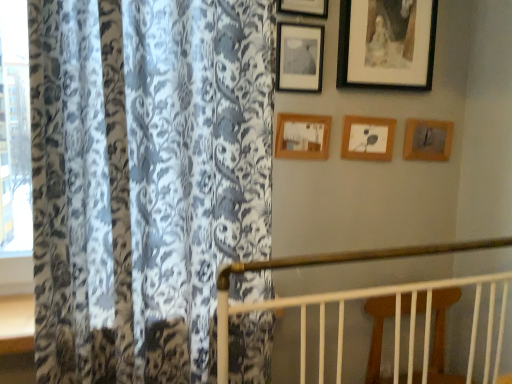
Question: Can you confirm if wooden picture frame at upper center, the 4th picture frame when ordered from left to right, is taller than wooden picture frame at upper center, which is the second picture frame from left to right?

Choices:
 (A) yes
 (B) no

Answer: (B)

Question: Does wooden picture frame at upper center, the 4th picture frame when ordered from left to right, come behind wooden picture frame at upper center, the fifth picture frame when ordered from right to left?

Choices:
 (A) yes
 (B) no

Answer: (A)

Question: From a real-world perspective, is wooden picture frame at upper center, the 4th picture frame when ordered from left to right, positioned under wooden picture frame at upper center, which is the second picture frame from left to right, based on gravity?

Choices:
 (A) yes
 (B) no

Answer: (A)

Question: Does wooden picture frame at upper center, the 4th picture frame when ordered from left to right, have a larger size compared to wooden picture frame at upper center, which is the second picture frame from left to right?

Choices:
 (A) yes
 (B) no

Answer: (B)

Question: Is wooden picture frame at upper center, the 4th picture frame when ordered from left to right, facing towards wooden picture frame at upper center, which is the second picture frame from left to right?

Choices:
 (A) yes
 (B) no

Answer: (B)

Question: Is wooden picture frame at upper center, positioned as the 3th picture frame in right-to-left order, looking in the opposite direction of wooden picture frame at upper center, which is the second picture frame from left to right?

Choices:
 (A) yes
 (B) no

Answer: (B)

Question: Considering the relative sizes of wooden picture frame at upper center, the fifth picture frame when ordered from right to left, and floral-patterned fabric at left in the image provided, is wooden picture frame at upper center, the fifth picture frame when ordered from right to left, bigger than floral-patterned fabric at left?

Choices:
 (A) yes
 (B) no

Answer: (B)

Question: Is wooden picture frame at upper center, the fifth picture frame when ordered from right to left, facing towards floral-patterned fabric at left?

Choices:
 (A) no
 (B) yes

Answer: (A)

Question: Is wooden picture frame at upper center, which is the second picture frame from left to right, behind floral-patterned fabric at left?

Choices:
 (A) no
 (B) yes

Answer: (B)

Question: Is wooden picture frame at upper center, which is the second picture frame from left to right, not close to floral-patterned fabric at left?

Choices:
 (A) no
 (B) yes

Answer: (A)

Question: From a real-world perspective, is wooden picture frame at upper center, which is the second picture frame from left to right, below floral-patterned fabric at left?

Choices:
 (A) no
 (B) yes

Answer: (A)

Question: Are wooden picture frame at upper center, the fifth picture frame when ordered from right to left, and floral-patterned fabric at left beside each other?

Choices:
 (A) no
 (B) yes

Answer: (A)

Question: Is wooden picture frame at upper center, the fifth picture frame when ordered from right to left, not near wooden picture frame at upper center, positioned as the 3th picture frame in right-to-left order?

Choices:
 (A) no
 (B) yes

Answer: (A)